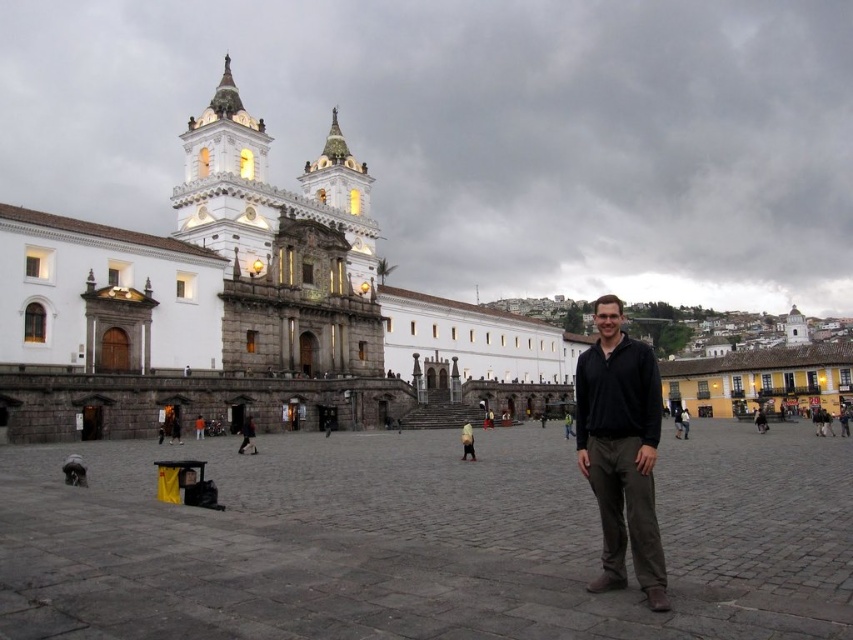
Can you confirm if white stone church at center is shorter than dark brown leather jacket at center?

Incorrect, white stone church at center's height does not fall short of dark brown leather jacket at center's.

Based on the photo, is white stone church at center wider than dark brown leather jacket at center?

Correct, the width of white stone church at center exceeds that of dark brown leather jacket at center.

Which is in front, point (363, 358) or point (247, 429)?

Point (247, 429) is in front.

Where is `white stone church at center`? The height and width of the screenshot is (640, 853). white stone church at center is located at coordinates (247, 308).

Between white stone church at center and black matte shirt at center, which one appears on the left side from the viewer's perspective?

white stone church at center is more to the left.

Does white stone church at center appear on the left side of black matte shirt at center?

Indeed, white stone church at center is positioned on the left side of black matte shirt at center.

Where is `white stone church at center`? This screenshot has height=640, width=853. white stone church at center is located at coordinates (247, 308).

How much distance is there between black matte shirt at center and dark brown leather jacket at center?

33.20 meters

In the scene shown: Does black matte shirt at center lie in front of dark brown leather jacket at center?

Yes, it is in front of dark brown leather jacket at center.

The width and height of the screenshot is (853, 640). Find the location of `black matte shirt at center`. black matte shirt at center is located at coordinates (621, 451).